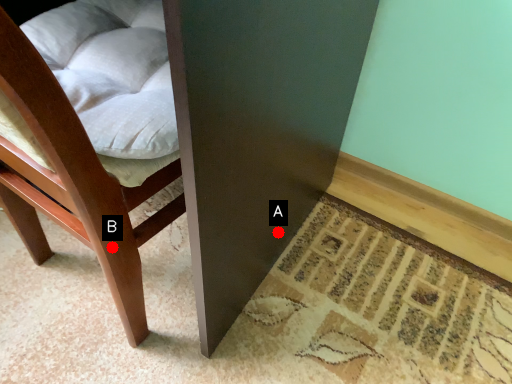
Question: Two points are circled on the image, labeled by A and B beside each circle. Which point appears farthest from the camera in this image?

Choices:
 (A) A is further
 (B) B is further

Answer: (A)